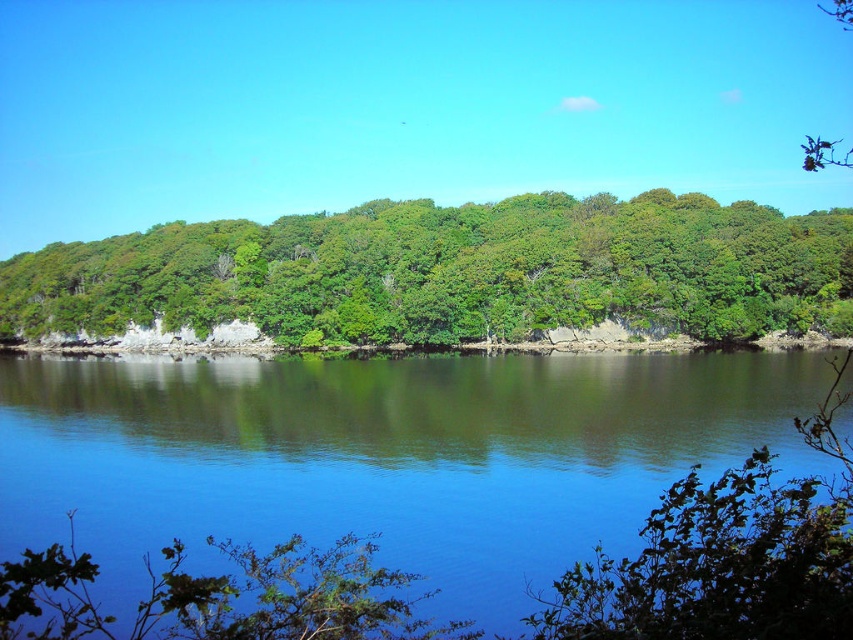
Who is positioned more to the left, smooth reflective water at center or green leafy trees at center?

From the viewer's perspective, green leafy trees at center appears more on the left side.

Which of these two, smooth reflective water at center or green leafy trees at center, stands taller?

green leafy trees at center is taller.

Does point (703, 468) lie in front of point (119, 262)?

Yes, it is in front of point (119, 262).

You are a GUI agent. You are given a task and a screenshot of the screen. Output one action in this format:
    pyautogui.click(x=<x>, y=<y>)
    Task: Click on the smooth reflective water at center
    
    Given the screenshot: What is the action you would take?
    pyautogui.click(x=386, y=458)